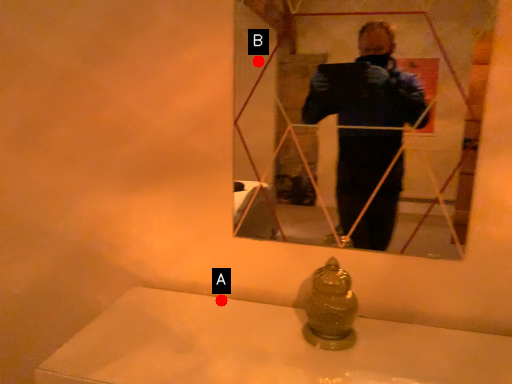
Question: Two points are circled on the image, labeled by A and B beside each circle. Which point is farther from the camera taking this photo?

Choices:
 (A) A is further
 (B) B is further

Answer: (B)